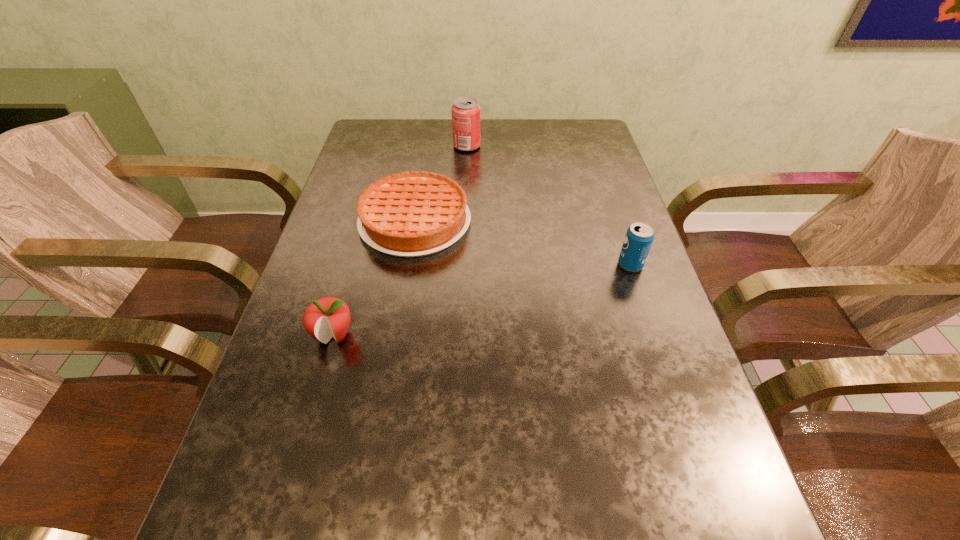
Where is `empty location between the apple and the rightmost object`? The image size is (960, 540). empty location between the apple and the rightmost object is located at coordinates (482, 300).

Image resolution: width=960 pixels, height=540 pixels. What are the coordinates of `free space between the farthest object and the shorter soda can` in the screenshot? It's located at (548, 205).

Locate an element on the screen. The width and height of the screenshot is (960, 540). empty space between the shorter soda can and the taller soda can is located at coordinates (548, 205).

What are the coordinates of `unoccupied area between the shortest object and the nearer soda can` in the screenshot? It's located at (522, 244).

Image resolution: width=960 pixels, height=540 pixels. I want to click on empty space between the right soda can and the shortest object, so click(522, 244).

Identify which object is the second closest to the shortest object. Please provide its 2D coordinates. Your answer should be formatted as a tuple, i.e. [(x, y)], where the tuple contains the x and y coordinates of a point satisfying the conditions above.

[(466, 111)]

Locate which object ranks in proximity to the rightmost object. Please provide its 2D coordinates. Your answer should be formatted as a tuple, i.e. [(x, y)], where the tuple contains the x and y coordinates of a point satisfying the conditions above.

[(410, 214)]

The image size is (960, 540). I want to click on free spot that satisfies the following two spatial constraints: 1. on the back side of the tallest object; 2. on the right side of the nearest object, so click(388, 146).

I want to click on free space that satisfies the following two spatial constraints: 1. on the back side of the farthest object; 2. on the left side of the nearest object, so click(388, 146).